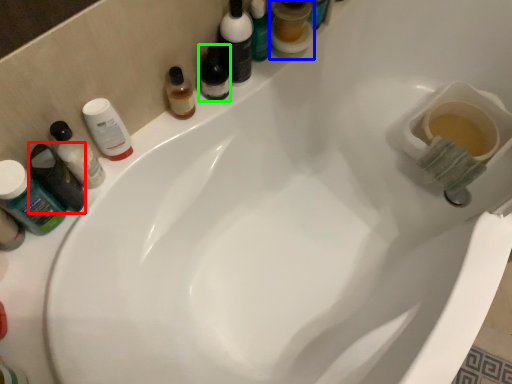
Question: Estimate the real-world distances between objects in this image. Which object is closer to toiletry (highlighted by a red box), mouthwash (highlighted by a blue box) or mouthwash (highlighted by a green box)?

Choices:
 (A) mouthwash
 (B) mouthwash

Answer: (B)